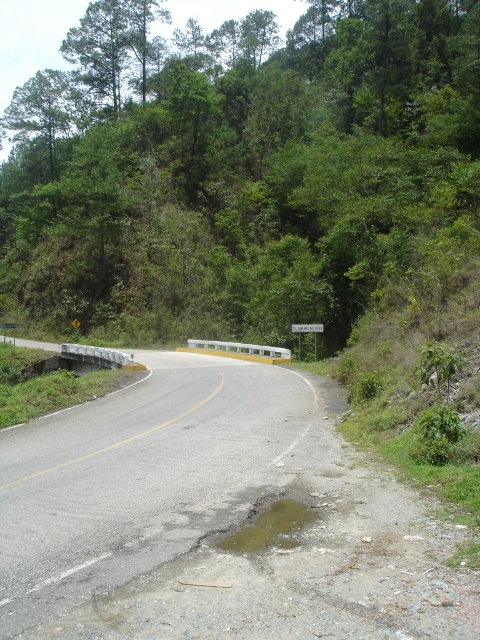
You are a hiker standing at the point labeled point (416, 64) and want to walk to the point labeled point (372, 502). Given the rural road described, which direction should you head relative to your current position?

Since point (416, 64) is further to the viewer than point (372, 502), you should head away from the viewer to reach the destination.

You are a hiker standing at the point with coordinates (x=241, y=170) on the rural road. What is the nearest object to you in the scene?

The nearest object to you is the green leafy tree at upper center, as the point coordinates (x=241, y=170) correspond to its location.

You are standing on the side of the road and want to cross the asphalt road at center. The road is 13.88 feet wide. If your walking speed is 3 feet per second, how many seconds will it take you to cross the road safely?

The asphalt road at center is 13.88 feet away from viewer. To cross the road safely, you need to cover the width of the road, which is 13.88 feet. At a walking speed of 3 feet per second, it would take approximately 4.63 seconds to cross the road safely.